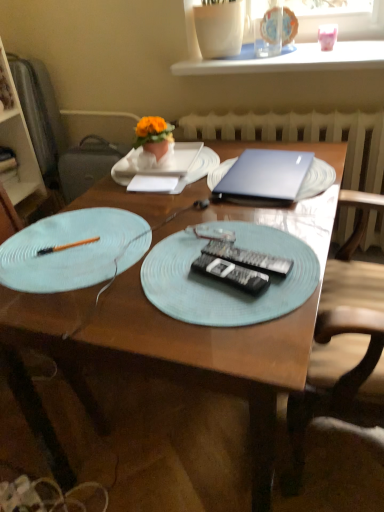
What do you see at coordinates (327, 36) in the screenshot? The image size is (384, 512). I see `pink glossy piggy bank at upper right, acting as the first tableware starting from the right` at bounding box center [327, 36].

How much space does pink glossy piggy bank at upper right, acting as the second tableware starting from the left, occupy horizontally?

pink glossy piggy bank at upper right, acting as the second tableware starting from the left, is 8.71 centimeters in width.

Measure the distance between point (247, 153) and camera.

They are 1.41 meters apart.

Image resolution: width=384 pixels, height=512 pixels. What do you see at coordinates (154, 135) in the screenshot? I see `orange fabric flower at upper center` at bounding box center [154, 135].

Identify the location of white ceramic vase at upper center. (291, 59).

Between wooden at right, which ranks as the 2th chair in left-to-right order, and wooden chair at left, the 2th chair when ordered from right to left, which one is positioned in front?

wooden at right, which ranks as the 2th chair in left-to-right order, is closer to the camera.

Between wooden at right, which ranks as the 2th chair in left-to-right order, and wooden chair at left, positioned as the first chair in left-to-right order, which one appears on the left side from the viewer's perspective?

Positioned to the left is wooden chair at left, positioned as the first chair in left-to-right order.

Which is farther, (352,264) or (22,373)?

The point (352,264) is farther from the camera.

Is there a large distance between wooden at right, which ranks as the 2th chair in left-to-right order, and wooden chair at left, the 2th chair when ordered from right to left?

No, wooden at right, which ranks as the 2th chair in left-to-right order, is not far away from wooden chair at left, the 2th chair when ordered from right to left.

You are a GUI agent. You are given a task and a screenshot of the screen. Output one action in this format:
    pyautogui.click(x=<x>, y=<y>)
    Task: Click on the chair on the left of white textured radiator at center
    
    Given the screenshot: What is the action you would take?
    pyautogui.click(x=39, y=420)

Is white textured radiator at center in contact with wooden chair at left, positioned as the first chair in left-to-right order?

No, white textured radiator at center is not next to wooden chair at left, positioned as the first chair in left-to-right order.

Considering the sizes of objects white textured radiator at center and wooden chair at left, the 2th chair when ordered from right to left, in the image provided, who is smaller, white textured radiator at center or wooden chair at left, the 2th chair when ordered from right to left,?

white textured radiator at center is smaller.

Can wooden chair at left, the 2th chair when ordered from right to left, be found inside white textured radiator at center?

No, wooden chair at left, the 2th chair when ordered from right to left, is not inside white textured radiator at center.

Looking at this image, considering the relative sizes of light blue textured plate at left, which is counted as the 2th plate, starting from the back, and pink glossy piggy bank at upper right, acting as the second tableware starting from the left, in the image provided, is light blue textured plate at left, which is counted as the 2th plate, starting from the back, bigger than pink glossy piggy bank at upper right, acting as the second tableware starting from the left,?

Yes.

Considering the sizes of light blue textured plate at left, which is counted as the 2th plate, starting from the back, and pink glossy piggy bank at upper right, acting as the second tableware starting from the left, in the image, is light blue textured plate at left, which is counted as the 2th plate, starting from the back, wider or thinner than pink glossy piggy bank at upper right, acting as the second tableware starting from the left,?

light blue textured plate at left, which is counted as the 2th plate, starting from the back, is wider than pink glossy piggy bank at upper right, acting as the second tableware starting from the left.

Measure the distance from light blue textured plate at left, which is counted as the 2th plate, starting from the back, to pink glossy piggy bank at upper right, acting as the first tableware starting from the right.

They are 4.17 feet apart.

Which is in front, light blue textured plate at left, placed as the second plate when sorted from front to back, or pink glossy piggy bank at upper right, acting as the first tableware starting from the right?

light blue textured plate at left, placed as the second plate when sorted from front to back, is closer to the camera.

Does wooden at right, which ranks as the 2th chair in left-to-right order, turn towards white wooden bookshelf at left?

Yes, wooden at right, which ranks as the 2th chair in left-to-right order, is oriented towards white wooden bookshelf at left.

Does wooden at right, which ranks as the first chair in right-to-left order, appear on the right side of white wooden bookshelf at left?

Yes.

Can we say wooden at right, which ranks as the 2th chair in left-to-right order, lies outside white wooden bookshelf at left?

Absolutely, wooden at right, which ranks as the 2th chair in left-to-right order, is external to white wooden bookshelf at left.

Does wooden at right, which ranks as the first chair in right-to-left order, have a greater width compared to white wooden bookshelf at left?

Incorrect, the width of wooden at right, which ranks as the first chair in right-to-left order, does not surpass that of white wooden bookshelf at left.

Looking at this image, considering the sizes of white paper at center and white paper plate at center, placed as the third plate when sorted from front to back, in the image, is white paper at center bigger or smaller than white paper plate at center, placed as the third plate when sorted from front to back,?

In the image, white paper at center appears to be smaller than white paper plate at center, placed as the third plate when sorted from front to back.

From a real-world perspective, is white paper at center located beneath white paper plate at center, which is the 1th plate in back-to-front order?

No, from a real-world perspective, white paper at center is not under white paper plate at center, which is the 1th plate in back-to-front order.

How many degrees apart are the facing directions of white paper at center and white paper plate at center, which is the 1th plate in back-to-front order?

The angular difference between white paper at center and white paper plate at center, which is the 1th plate in back-to-front order, is 7.65 degrees.

Which point is more forward, [140,180] or [208,168]?

The point [140,180] is closer.

Is white paper plate at center, which is the 1th plate in back-to-front order, turned away from transparent glass cup at upper center, which is counted as the second tableware, starting from the right?

No.

Which is in front, point (202, 162) or point (276, 39)?

The point (202, 162) is closer to the camera.

Considering the relative positions of white paper plate at center, which is the 1th plate in back-to-front order, and transparent glass cup at upper center, which ranks as the first tableware in left-to-right order, in the image provided, is white paper plate at center, which is the 1th plate in back-to-front order, to the left of transparent glass cup at upper center, which ranks as the first tableware in left-to-right order, from the viewer's perspective?

Yes, white paper plate at center, which is the 1th plate in back-to-front order, is to the left of transparent glass cup at upper center, which ranks as the first tableware in left-to-right order.

In the scene shown: Could you tell me if light blue textured plate at left, which is counted as the 2th plate, starting from the back, is facing sleek metallic laptop at upper right?

No, light blue textured plate at left, which is counted as the 2th plate, starting from the back, is not aimed at sleek metallic laptop at upper right.

From their relative heights in the image, would you say light blue textured plate at left, which is counted as the 2th plate, starting from the back, is taller or shorter than sleek metallic laptop at upper right?

In the image, light blue textured plate at left, which is counted as the 2th plate, starting from the back, appears to be shorter than sleek metallic laptop at upper right.

Which is closer, (37,259) or (239,163)?

Positioned in front is point (37,259).

Would you say light blue textured plate at left, placed as the second plate when sorted from front to back, is inside or outside sleek metallic laptop at upper right?

light blue textured plate at left, placed as the second plate when sorted from front to back, is outside sleek metallic laptop at upper right.

This screenshot has width=384, height=512. Find the location of `chair directly beneath the wooden at right, which ranks as the 2th chair in left-to-right order (from a real-world perspective)`. chair directly beneath the wooden at right, which ranks as the 2th chair in left-to-right order (from a real-world perspective) is located at coordinates (39, 420).

Locate an element on the screen. chair on the left side of white textured radiator at center is located at coordinates (39, 420).

Estimate the real-world distances between objects in this image. Which object is closer to sleek metallic laptop at upper right, wooden at right, which ranks as the first chair in right-to-left order, or white textured radiator at center?

wooden at right, which ranks as the first chair in right-to-left order, lies closer to sleek metallic laptop at upper right than the other object.

Considering their positions, is wooden table at center positioned further to wooden chair at left, the 2th chair when ordered from right to left, than white ceramic vase at upper center?

white ceramic vase at upper center lies further to wooden chair at left, the 2th chair when ordered from right to left, than the other object.

Estimate the real-world distances between objects in this image. Which object is closer to orange fabric flower at upper center, white ceramic vase at upper center or wooden at right, which ranks as the first chair in right-to-left order?

white ceramic vase at upper center.

When comparing their distances from orange fabric flower at upper center, does white wooden bookshelf at left or pink glossy piggy bank at upper right, acting as the first tableware starting from the right, seem further?

Among the two, pink glossy piggy bank at upper right, acting as the first tableware starting from the right, is located further to orange fabric flower at upper center.

Looking at the image, which one is located further to white paper plate at center, which is the 1th plate in back-to-front order, transparent glass cup at upper center, which ranks as the first tableware in left-to-right order, or white wooden bookshelf at left?

white wooden bookshelf at left is further to white paper plate at center, which is the 1th plate in back-to-front order.

From the picture: Estimate the real-world distances between objects in this image. Which object is closer to pink glossy piggy bank at upper right, acting as the second tableware starting from the left, white paper plate at center, placed as the third plate when sorted from front to back, or black plastic remote control at center, acting as the first remote control starting from the top?

white paper plate at center, placed as the third plate when sorted from front to back, lies closer to pink glossy piggy bank at upper right, acting as the second tableware starting from the left, than the other object.

When comparing their distances from wooden chair at left, positioned as the first chair in left-to-right order, does transparent glass cup at upper center, which is counted as the second tableware, starting from the right, or white paper plate at center, placed as the third plate when sorted from front to back, seem closer?

The object closer to wooden chair at left, positioned as the first chair in left-to-right order, is white paper plate at center, placed as the third plate when sorted from front to back.

When comparing their distances from light blue textured plate at left, placed as the second plate when sorted from front to back, does black plastic remote control at center, the second remote control in the top-to-bottom sequence, or white wooden bookshelf at left seem further?

white wooden bookshelf at left is further to light blue textured plate at left, placed as the second plate when sorted from front to back.

At what (x,y) coordinates should I click in order to perform the action: click on desk between wooden at right, which ranks as the first chair in right-to-left order, and white paper at center, along the z-axis. Please return your answer as a coordinate pair (x, y). The height and width of the screenshot is (512, 384). Looking at the image, I should click on 174,351.

Where is `houseplant between white ceramic vase at upper center and wooden table at center vertically`? This screenshot has height=512, width=384. houseplant between white ceramic vase at upper center and wooden table at center vertically is located at coordinates (154, 135).

This screenshot has width=384, height=512. Find the location of `laptop between white wooden bookshelf at left and transparent glass cup at upper center, which ranks as the first tableware in left-to-right order, from left to right`. laptop between white wooden bookshelf at left and transparent glass cup at upper center, which ranks as the first tableware in left-to-right order, from left to right is located at coordinates [x=266, y=174].

This screenshot has width=384, height=512. I want to click on remote control located between light blue textured plate at left, which is counted as the 2th plate, starting from the back, and black plastic remote control at center, placed as the 2th remote control when sorted from bottom to top, in the left-right direction, so click(231, 274).